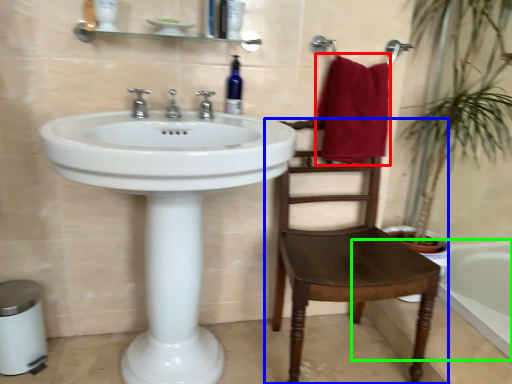
Question: Based on their relative distances, which object is farther from bath towel (highlighted by a red box)? Choose from chair (highlighted by a blue box) and bath (highlighted by a green box).

Choices:
 (A) chair
 (B) bath

Answer: (B)